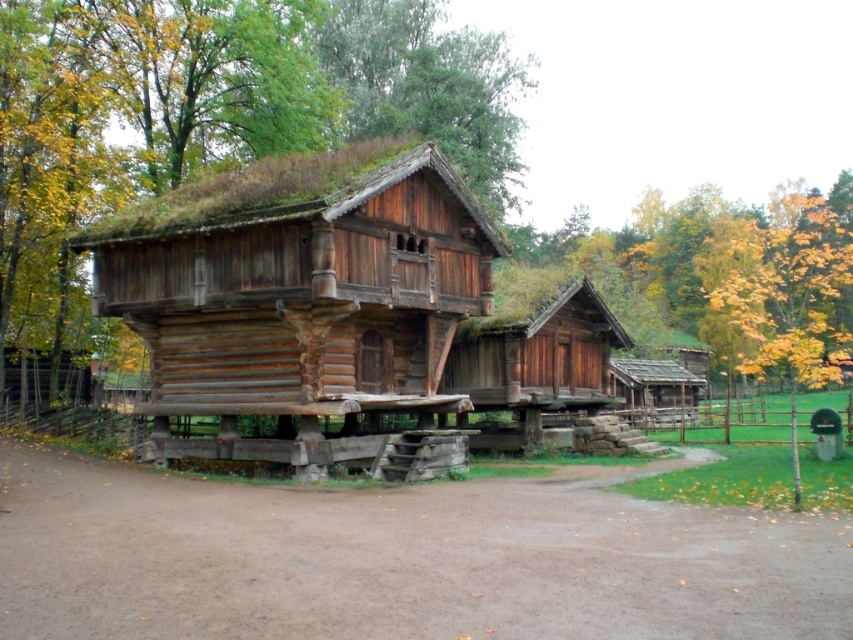
Based on the scene description, what is located at the coordinates point [219,109]?

The green mossy roof at center is located at point [219,109].